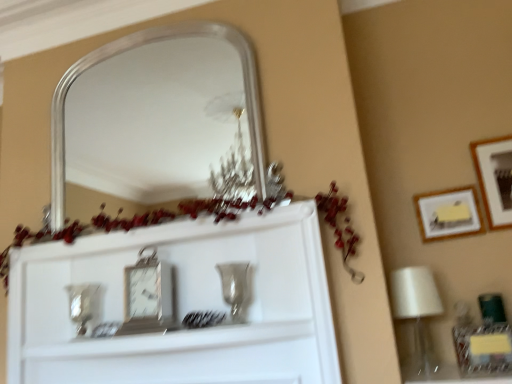
Question: Could you tell me if wooden framed picture at right, which is counted as the 1th picture frame, starting from the right, is turned towards metallic rectangular clock at center?

Choices:
 (A) no
 (B) yes

Answer: (A)

Question: From the image's perspective, is wooden framed picture at right, which is counted as the 1th picture frame, starting from the right, under metallic rectangular clock at center?

Choices:
 (A) no
 (B) yes

Answer: (A)

Question: Can you confirm if wooden framed picture at right, which is counted as the 1th picture frame, starting from the right, is bigger than metallic rectangular clock at center?

Choices:
 (A) no
 (B) yes

Answer: (A)

Question: Is metallic rectangular clock at center inside wooden framed picture at right, which is counted as the 1th picture frame, starting from the right?

Choices:
 (A) no
 (B) yes

Answer: (A)

Question: From the image's perspective, is wooden framed picture at right, which is the 2th picture frame in left-to-right order, located above metallic rectangular clock at center?

Choices:
 (A) yes
 (B) no

Answer: (A)

Question: Is metallic rectangular clock at center in front of or behind wooden framed picture at right, which is the 2th picture frame in left-to-right order, in the image?

Choices:
 (A) behind
 (B) front

Answer: (B)

Question: Is point (143, 292) positioned closer to the camera than point (509, 226)?

Choices:
 (A) closer
 (B) farther

Answer: (A)

Question: From the image's perspective, is metallic rectangular clock at center located above or below wooden framed picture at right, which is the 2th picture frame in left-to-right order?

Choices:
 (A) above
 (B) below

Answer: (B)

Question: From their relative heights in the image, would you say metallic rectangular clock at center is taller or shorter than wooden framed picture at right, which is the 2th picture frame in left-to-right order?

Choices:
 (A) short
 (B) tall

Answer: (A)

Question: In the image, is metallic rectangular clock at center on the left side or the right side of metallic silver clock at center?

Choices:
 (A) left
 (B) right

Answer: (A)

Question: Is metallic rectangular clock at center inside the boundaries of metallic silver clock at center, or outside?

Choices:
 (A) outside
 (B) inside

Answer: (A)

Question: Considering their positions, is metallic rectangular clock at center located in front of or behind metallic silver clock at center?

Choices:
 (A) front
 (B) behind

Answer: (B)

Question: Is point [150, 317] closer or farther from the camera than point [169, 342]?

Choices:
 (A) closer
 (B) farther

Answer: (B)

Question: Considering their positions, is metallic silver clock at center located in front of or behind silver/metallic mirror at upper center?

Choices:
 (A) front
 (B) behind

Answer: (A)

Question: Is metallic silver clock at center inside or outside of silver/metallic mirror at upper center?

Choices:
 (A) outside
 (B) inside

Answer: (A)